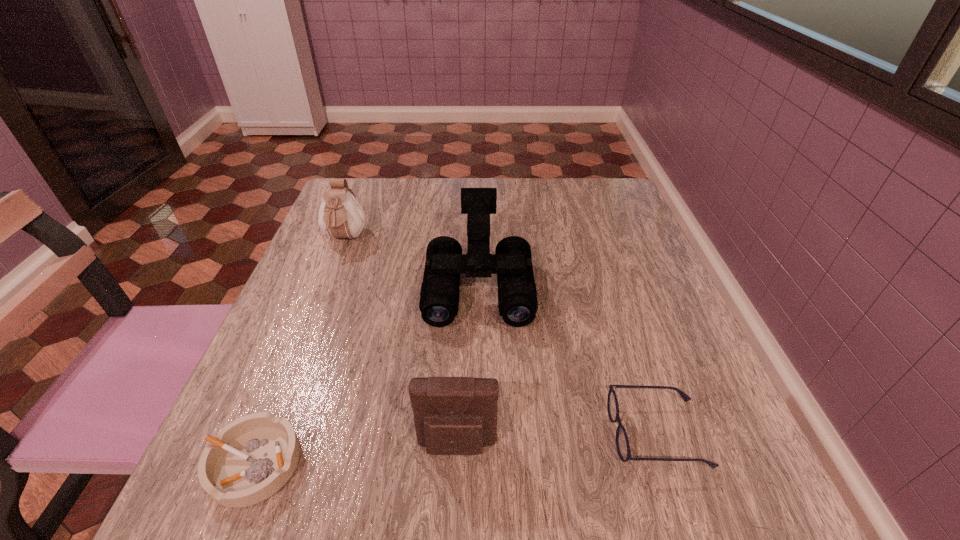
The height and width of the screenshot is (540, 960). I want to click on free space that is in between the farther pouch and the ashtray, so (300, 351).

At what (x,y) coordinates should I click in order to perform the action: click on free space between the left pouch and the spectacles. Please return your answer as a coordinate pair (x, y). Looking at the image, I should click on (501, 336).

Where is `empty space that is in between the spectacles and the nearer pouch`? The height and width of the screenshot is (540, 960). empty space that is in between the spectacles and the nearer pouch is located at coordinates (x=557, y=440).

The image size is (960, 540). I want to click on vacant area between the rightmost object and the nearer pouch, so click(x=557, y=440).

You are a GUI agent. You are given a task and a screenshot of the screen. Output one action in this format:
    pyautogui.click(x=<x>, y=<y>)
    Task: Click on the vacant region between the rightmost object and the farther pouch
    The height and width of the screenshot is (540, 960).
    Given the screenshot: What is the action you would take?
    pyautogui.click(x=501, y=336)

The height and width of the screenshot is (540, 960). In order to click on free space between the farther pouch and the binoculars in this screenshot , I will do `click(412, 262)`.

The height and width of the screenshot is (540, 960). In order to click on object that is the second closest one to the farther pouch in this screenshot , I will do `click(254, 456)`.

At what (x,y) coordinates should I click in order to perform the action: click on object that is the third closest to the nearer pouch. Please return your answer as a coordinate pair (x, y). This screenshot has height=540, width=960. Looking at the image, I should click on (512, 262).

You are a GUI agent. You are given a task and a screenshot of the screen. Output one action in this format:
    pyautogui.click(x=<x>, y=<y>)
    Task: Click on the vacant space that satisfies the following two spatial constraints: 1. on the front-facing side of the second shortest object; 2. with an open flap on the nearer pouch
    The height and width of the screenshot is (540, 960).
    Given the screenshot: What is the action you would take?
    pyautogui.click(x=662, y=447)